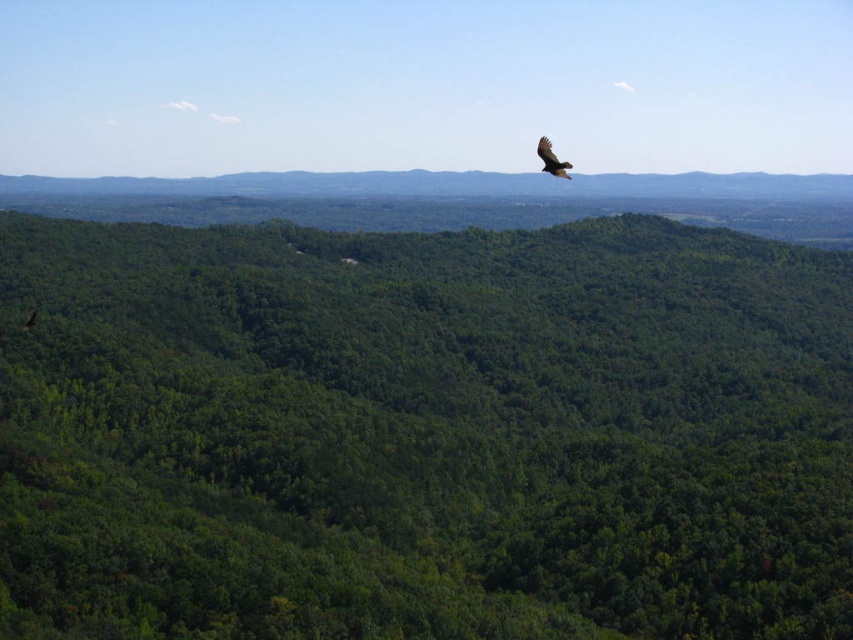
You are a bird flying over the green leafy forest at center and the dark brown feathers at upper center. Which object would you see first from above?

The green leafy forest at center is wider than the dark brown feathers at upper center, so you would see the green leafy forest at center first from above.

Based on the coordinates provided, where is the green leafy forest at center located in the image?

The green leafy forest at center is located at the coordinates point (422,433).